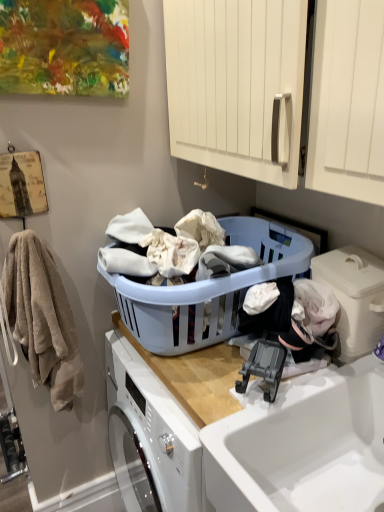
Question: Considering the relative positions of beige soft towel at left and white plastic container at lower right in the image provided, is beige soft towel at left behind white plastic container at lower right?

Choices:
 (A) yes
 (B) no

Answer: (A)

Question: From the image's perspective, is beige soft towel at left on top of white plastic container at lower right?

Choices:
 (A) yes
 (B) no

Answer: (B)

Question: Is beige soft towel at left thinner than white plastic container at lower right?

Choices:
 (A) yes
 (B) no

Answer: (A)

Question: Can you confirm if beige soft towel at left is bigger than white plastic container at lower right?

Choices:
 (A) yes
 (B) no

Answer: (A)

Question: Could you tell me if beige soft towel at left is turned towards white plastic container at lower right?

Choices:
 (A) yes
 (B) no

Answer: (B)

Question: Looking at their shapes, would you say light blue plastic laundry basket at center is wider or thinner than white plastic container at lower right?

Choices:
 (A) wide
 (B) thin

Answer: (A)

Question: In terms of height, does light blue plastic laundry basket at center look taller or shorter compared to white plastic container at lower right?

Choices:
 (A) short
 (B) tall

Answer: (B)

Question: Based on their positions, is light blue plastic laundry basket at center located to the left or right of white plastic container at lower right?

Choices:
 (A) right
 (B) left

Answer: (B)

Question: In terms of size, does light blue plastic laundry basket at center appear bigger or smaller than white plastic container at lower right?

Choices:
 (A) small
 (B) big

Answer: (B)

Question: Is point (279, 484) positioned closer to the camera than point (329, 276)?

Choices:
 (A) farther
 (B) closer

Answer: (B)

Question: Is white glossy sink at lower right wider or thinner than white plastic container at lower right?

Choices:
 (A) thin
 (B) wide

Answer: (B)

Question: Do you think white glossy sink at lower right is within white plastic container at lower right, or outside of it?

Choices:
 (A) outside
 (B) inside

Answer: (A)

Question: Is white glossy sink at lower right to the left or to the right of white plastic container at lower right in the image?

Choices:
 (A) right
 (B) left

Answer: (B)

Question: From the image's perspective, is white plastic container at lower right positioned above or below light blue plastic laundry basket at center?

Choices:
 (A) below
 (B) above

Answer: (A)

Question: In terms of height, does white plastic container at lower right look taller or shorter compared to light blue plastic laundry basket at center?

Choices:
 (A) short
 (B) tall

Answer: (A)